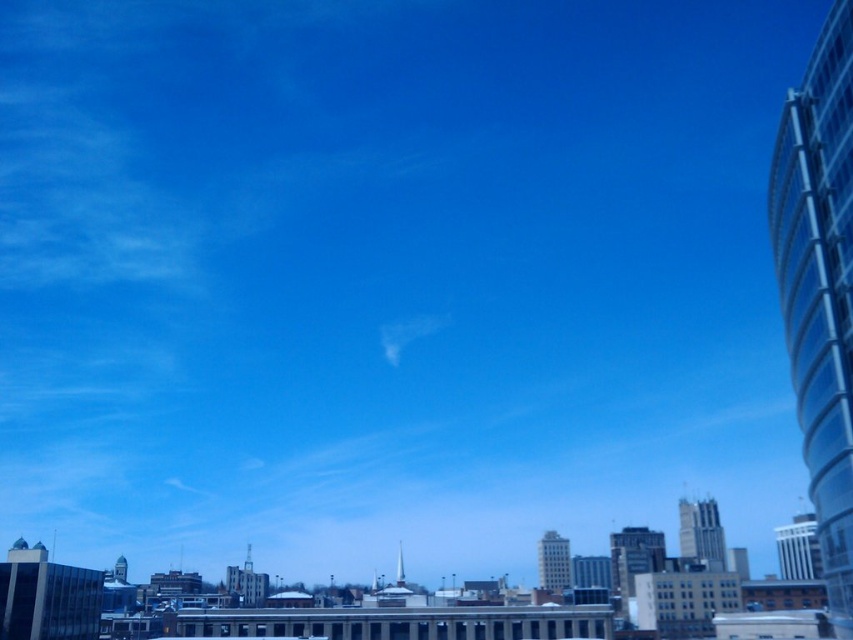
You are a city planner reviewing a proposed building design. The new building must be placed at point (553, 561). According to the current city layout, what type of structure is already present at that location?

At point (553, 561) lies gray concrete skyscraper at center.

You are standing in the city and see the dark gray glass building at center and the white glass tower at right. Which building is positioned to the left of the other?

The dark gray glass building at center is positioned to the left of the white glass tower at right.

You are an architect analyzing the city layout. The transparent glass tower at right is located at point [820,288]. What is the coordinate of the transparent glass tower at right?

The transparent glass tower at right is located at point [820,288].